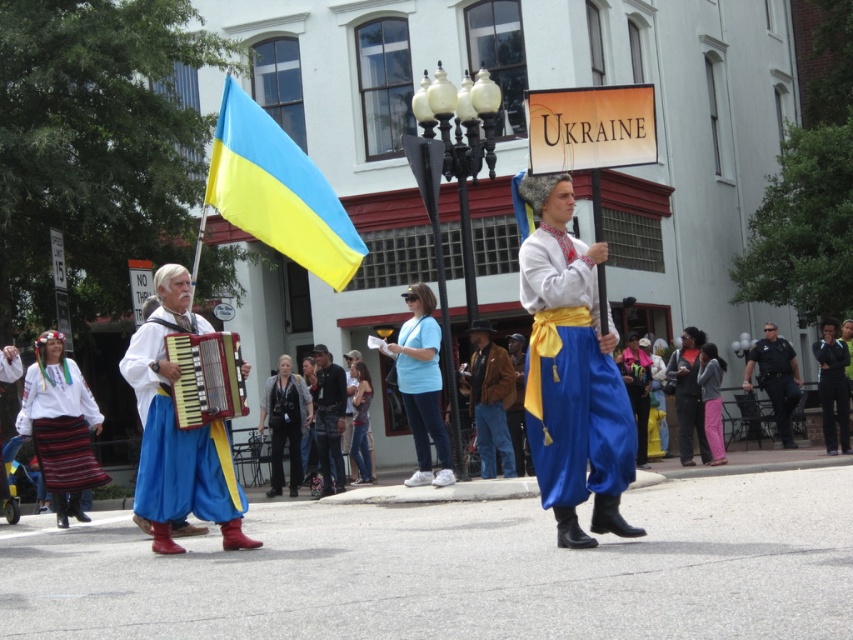
In the scene shown: Is light blue cotton shirt at center smaller than wooden accordion at center?

Actually, light blue cotton shirt at center might be larger than wooden accordion at center.

Which is in front, point (421, 442) or point (207, 403)?

Positioned in front is point (207, 403).

This screenshot has height=640, width=853. Describe the element at coordinates (422, 387) in the screenshot. I see `light blue cotton shirt at center` at that location.

The image size is (853, 640). I want to click on light blue cotton shirt at center, so click(x=422, y=387).

Who is taller, embroidered cotton skirt at lower left or denim jacket at center?

Standing taller between the two is denim jacket at center.

Who is shorter, embroidered cotton skirt at lower left or denim jacket at center?

embroidered cotton skirt at lower left

What do you see at coordinates (61, 426) in the screenshot?
I see `embroidered cotton skirt at lower left` at bounding box center [61, 426].

Find the location of a particular element. The width and height of the screenshot is (853, 640). embroidered cotton skirt at lower left is located at coordinates (61, 426).

Is light blue cotton shirt at center further to the viewer compared to blue satin robe at center?

No, light blue cotton shirt at center is closer to the viewer.

Can you confirm if light blue cotton shirt at center is positioned to the left of blue satin robe at center?

Correct, you'll find light blue cotton shirt at center to the left of blue satin robe at center.

Is point (421, 410) farther from viewer compared to point (640, 435)?

No, it is in front of (640, 435).

Find the location of a particular element. light blue cotton shirt at center is located at coordinates (422, 387).